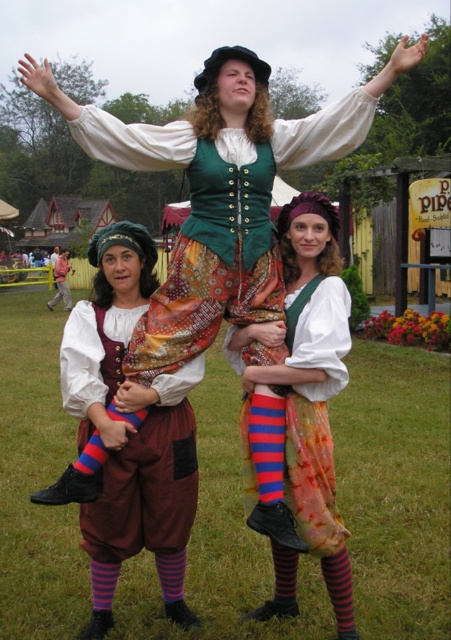
Between matte green fabric vest at center and matte brown leather belt at center, which one has less height?

matte brown leather belt at center is shorter.

Does matte green fabric vest at center have a greater width compared to matte brown leather belt at center?

Indeed, matte green fabric vest at center has a greater width compared to matte brown leather belt at center.

The height and width of the screenshot is (640, 451). What do you see at coordinates (133, 140) in the screenshot? I see `matte green fabric vest at center` at bounding box center [133, 140].

Identify the location of matte green fabric vest at center. (133, 140).

Is the position of matte brown leather skirt at center less distant than that of matte white blouse at center?

No, matte brown leather skirt at center is behind matte white blouse at center.

Is matte brown leather skirt at center to the right of matte white blouse at center from the viewer's perspective?

Incorrect, matte brown leather skirt at center is not on the right side of matte white blouse at center.

Find the location of `matte brown leather skirt at center`. matte brown leather skirt at center is located at coordinates (129, 429).

Can you confirm if matte brown leather skirt at center is positioned to the right of matte green fabric vest at center?

Incorrect, matte brown leather skirt at center is not on the right side of matte green fabric vest at center.

Is matte brown leather skirt at center bigger than matte green fabric vest at center?

No, matte brown leather skirt at center is not bigger than matte green fabric vest at center.

Which is behind, point (153, 429) or point (320, 157)?

The point (320, 157) is more distant.

Locate an element on the screen. matte brown leather skirt at center is located at coordinates (129, 429).